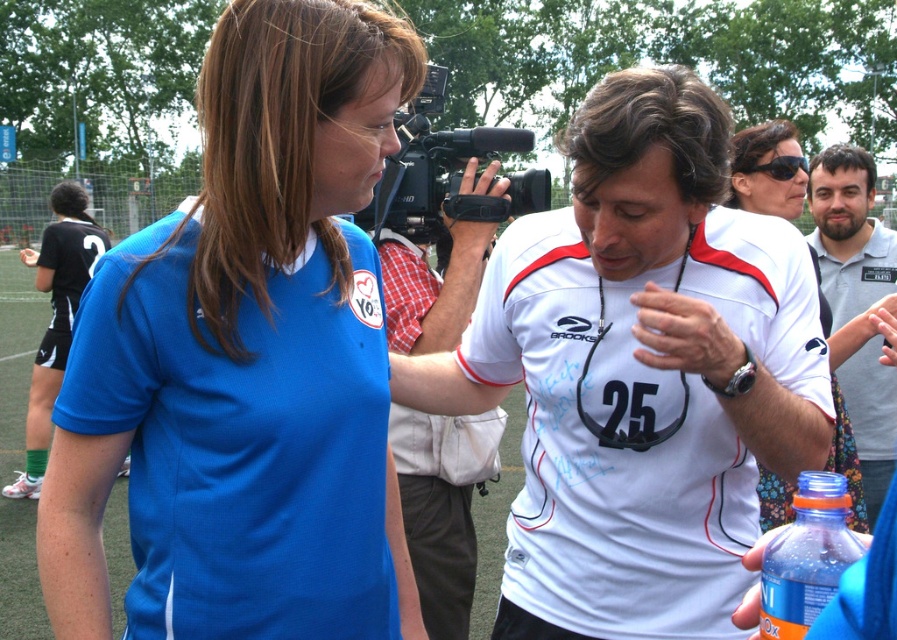
Question: Does white fabric shirt at center appear under matte black sunglasses at upper right?

Choices:
 (A) yes
 (B) no

Answer: (B)

Question: Which of the following is the closest to the observer?

Choices:
 (A) (860, 513)
 (B) (823, 237)

Answer: (A)

Question: Does matte blue jersey at center lie in front of gray cotton polo shirt at center?

Choices:
 (A) yes
 (B) no

Answer: (A)

Question: Does gray cotton polo shirt at center lie behind black plastic video camera at center?

Choices:
 (A) yes
 (B) no

Answer: (A)

Question: Among these objects, which one is farthest from the camera?

Choices:
 (A) matte black sunglasses at upper right
 (B) white matte jersey at center
 (C) matte blue jersey at center
 (D) black plastic video camera at center

Answer: (B)

Question: Considering the real-world distances, which object is farthest from the gray cotton polo shirt at center?

Choices:
 (A) black plastic video camera at center
 (B) matte black sunglasses at upper right
 (C) white fabric shirt at center
 (D) translucent plastic bottle at lower right

Answer: (D)